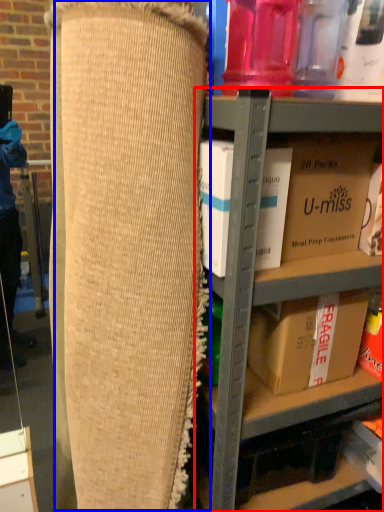
Question: Which of the following is the closest to the observer, shelf (highlighted by a red box) or bean bag chair (highlighted by a blue box)?

Choices:
 (A) shelf
 (B) bean bag chair

Answer: (B)